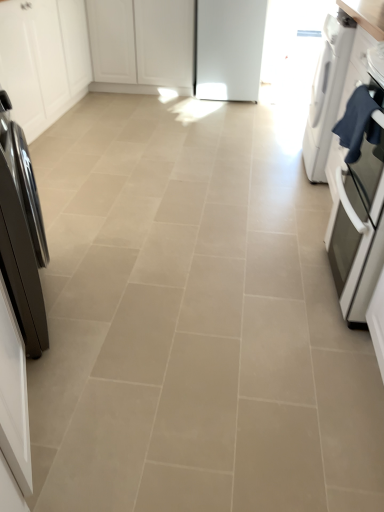
You are a GUI agent. You are given a task and a screenshot of the screen. Output one action in this format:
    pyautogui.click(x=<x>, y=<y>)
    Task: Click on the white matte cabinet at center, the first cabinetry when ordered from right to left
    The height and width of the screenshot is (512, 384).
    Given the screenshot: What is the action you would take?
    pyautogui.click(x=142, y=44)

I want to click on white glossy dryer at right, positioned as the 1th home appliance in right-to-left order, so click(327, 92).

Locate an element on the screen. The height and width of the screenshot is (512, 384). dark blue fabric at right is located at coordinates pyautogui.click(x=359, y=122).

Describe the element at coordinates (359, 207) in the screenshot. I see `matte stainless steel oven at right` at that location.

This screenshot has height=512, width=384. I want to click on matte stainless steel oven at right, so click(x=359, y=207).

Find the location of a particular element. shiny black refrigerator at left, positioned as the 2th home appliance in top-to-bottom order is located at coordinates (21, 234).

Is point (30, 345) positioned before point (330, 96)?

Yes, it is.

Considering the sizes of objects shiny black refrigerator at left, which is the first home appliance in bottom-to-top order, and white glossy dryer at right, positioned as the 1th home appliance in right-to-left order, in the image provided, who is taller, shiny black refrigerator at left, which is the first home appliance in bottom-to-top order, or white glossy dryer at right, positioned as the 1th home appliance in right-to-left order,?

shiny black refrigerator at left, which is the first home appliance in bottom-to-top order, is taller.

Is shiny black refrigerator at left, which is the first home appliance in bottom-to-top order, looking in the opposite direction of white glossy dryer at right, placed as the second home appliance when sorted from front to back?

No, shiny black refrigerator at left, which is the first home appliance in bottom-to-top order,'s orientation is not away from white glossy dryer at right, placed as the second home appliance when sorted from front to back.

From a real-world perspective, is shiny black refrigerator at left, which is the first home appliance in bottom-to-top order, positioned under white glossy dryer at right, positioned as the first home appliance in top-to-bottom order, based on gravity?

No.

Which of these two, matte stainless steel oven at right or white glossy dryer at right, the 1th home appliance from the back, stands shorter?

matte stainless steel oven at right is shorter.

Measure the distance from matte stainless steel oven at right to white glossy dryer at right, which is counted as the 2th home appliance, starting from the left.

matte stainless steel oven at right and white glossy dryer at right, which is counted as the 2th home appliance, starting from the left, are 24.16 inches apart.

Does matte stainless steel oven at right have a smaller size compared to white glossy dryer at right, which is counted as the 2th home appliance, starting from the left?

Correct, matte stainless steel oven at right occupies less space than white glossy dryer at right, which is counted as the 2th home appliance, starting from the left.

How many degrees apart are the facing directions of matte stainless steel oven at right and white glossy dryer at right, placed as the second home appliance when sorted from front to back?

0.000753 degrees separate the facing orientations of matte stainless steel oven at right and white glossy dryer at right, placed as the second home appliance when sorted from front to back.

From a real-world perspective, is white glossy dryer at right, positioned as the first home appliance in top-to-bottom order, physically located above or below shiny black refrigerator at left, the 1th home appliance from the front?

In terms of real-world spatial position, white glossy dryer at right, positioned as the first home appliance in top-to-bottom order, is below shiny black refrigerator at left, the 1th home appliance from the front.

Is white glossy dryer at right, positioned as the first home appliance in top-to-bottom order, to the left of shiny black refrigerator at left, which is the second home appliance from back to front, from the viewer's perspective?

No.

Between white glossy dryer at right, the 1th home appliance from the back, and shiny black refrigerator at left, marked as the 2th home appliance in a right-to-left arrangement, which one is positioned behind?

white glossy dryer at right, the 1th home appliance from the back.

Can you confirm if white glossy dryer at right, positioned as the 1th home appliance in right-to-left order, is taller than shiny black refrigerator at left, which is the second home appliance from back to front?

Incorrect, the height of white glossy dryer at right, positioned as the 1th home appliance in right-to-left order, is not larger of that of shiny black refrigerator at left, which is the second home appliance from back to front.

Does point (22, 164) appear closer or farther from the camera than point (363, 153)?

Point (22, 164) is closer to the camera than point (363, 153).

From a real-world perspective, between shiny black refrigerator at left, the 1th home appliance from the front, and matte stainless steel oven at right, who is vertically lower?

From a 3D spatial view, matte stainless steel oven at right is below.

Does shiny black refrigerator at left, marked as the 2th home appliance in a right-to-left arrangement, lie in front of matte stainless steel oven at right?

Yes, it is in front of matte stainless steel oven at right.

From the picture: Which of these two, shiny black refrigerator at left, which is the first home appliance in bottom-to-top order, or matte stainless steel oven at right, is bigger?

With larger size is matte stainless steel oven at right.

Which is correct: dark blue fabric at right is inside white matte cabinet at upper left, the 2th cabinetry from the right, or outside of it?

dark blue fabric at right exists outside the volume of white matte cabinet at upper left, the 2th cabinetry from the right.

Does point (351, 138) come farther from viewer compared to point (24, 44)?

No.

Is dark blue fabric at right far from white matte cabinet at upper left, the 2th cabinetry from the right?

That's right, there is a large distance between dark blue fabric at right and white matte cabinet at upper left, the 2th cabinetry from the right.

From a real-world perspective, relative to white matte cabinet at upper left, acting as the first cabinetry starting from the left, is white glossy dryer at right, the 1th home appliance from the back, vertically above or below?

In terms of real-world spatial position, white glossy dryer at right, the 1th home appliance from the back, is below white matte cabinet at upper left, acting as the first cabinetry starting from the left.

Which object is closer to the camera, white glossy dryer at right, positioned as the first home appliance in top-to-bottom order, or white matte cabinet at upper left, the 2th cabinetry from the right?

white glossy dryer at right, positioned as the first home appliance in top-to-bottom order, is closer to the camera.

Is white glossy dryer at right, positioned as the first home appliance in top-to-bottom order, facing away from white matte cabinet at upper left, the 2th cabinetry from the right?

white glossy dryer at right, positioned as the first home appliance in top-to-bottom order, does not have its back to white matte cabinet at upper left, the 2th cabinetry from the right.

How different are the orientations of white matte cabinet at upper left, acting as the first cabinetry starting from the left, and white matte cabinet at center, the second cabinetry viewed from the left, in degrees?

There is a 89.7-degree angle between the facing directions of white matte cabinet at upper left, acting as the first cabinetry starting from the left, and white matte cabinet at center, the second cabinetry viewed from the left.

Between point (80, 77) and point (91, 35), which one is positioned behind?

The point (91, 35) is farther from the camera.

Is the surface of white matte cabinet at upper left, acting as the first cabinetry starting from the left, in direct contact with white matte cabinet at center, the first cabinetry when ordered from right to left?

No, white matte cabinet at upper left, acting as the first cabinetry starting from the left, is not next to white matte cabinet at center, the first cabinetry when ordered from right to left.

From the image's perspective, relative to white matte cabinet at center, the second cabinetry viewed from the left, is white matte cabinet at upper left, the 2th cabinetry from the right, above or below?

white matte cabinet at upper left, the 2th cabinetry from the right, is situated lower than white matte cabinet at center, the second cabinetry viewed from the left, in the image.

The image size is (384, 512). What are the coordinates of `home appliance in front of the white glossy dryer at right, positioned as the 1th home appliance in right-to-left order` in the screenshot? It's located at (21, 234).

You are a GUI agent. You are given a task and a screenshot of the screen. Output one action in this format:
    pyautogui.click(x=<x>, y=<y>)
    Task: Click on the home appliance that is the 1st one above the matte stainless steel oven at right (from a real-world perspective)
    
    Given the screenshot: What is the action you would take?
    [327, 92]

Looking at the image, which one is located further to dark blue fabric at right, white matte cabinet at center, the second cabinetry viewed from the left, or matte stainless steel oven at right?

white matte cabinet at center, the second cabinetry viewed from the left, is further to dark blue fabric at right.

Which object lies nearer to the anchor point white matte cabinet at center, the first cabinetry when ordered from right to left, white matte cabinet at upper left, the 2th cabinetry from the right, or matte stainless steel oven at right?

The object closer to white matte cabinet at center, the first cabinetry when ordered from right to left, is white matte cabinet at upper left, the 2th cabinetry from the right.

Estimate the real-world distances between objects in this image. Which object is further from white matte cabinet at upper left, acting as the first cabinetry starting from the left, dark blue fabric at right or white glossy dryer at right, which is counted as the 2th home appliance, starting from the left?

dark blue fabric at right is positioned further to the anchor white matte cabinet at upper left, acting as the first cabinetry starting from the left.

Estimate the real-world distances between objects in this image. Which object is closer to shiny black refrigerator at left, the 1th home appliance from the front, white matte cabinet at upper left, the 2th cabinetry from the right, or matte stainless steel oven at right?

matte stainless steel oven at right.

Looking at the image, which one is located closer to white matte cabinet at center, the first cabinetry when ordered from right to left, shiny black refrigerator at left, the 1th home appliance from the left, or matte stainless steel oven at right?

Based on the image, matte stainless steel oven at right appears to be nearer to white matte cabinet at center, the first cabinetry when ordered from right to left.

Based on their spatial positions, is matte stainless steel oven at right or white matte cabinet at center, the second cabinetry viewed from the left, closer to dark blue fabric at right?

The object closer to dark blue fabric at right is matte stainless steel oven at right.

Looking at this image, from the image, which object appears to be farther from matte stainless steel oven at right, white glossy dryer at right, arranged as the second home appliance when ordered from the bottom, or white matte cabinet at center, the first cabinetry when ordered from right to left?

white matte cabinet at center, the first cabinetry when ordered from right to left, lies further to matte stainless steel oven at right than the other object.

Looking at the image, which one is located further to matte stainless steel oven at right, dark blue fabric at right or white matte cabinet at center, the second cabinetry viewed from the left?

white matte cabinet at center, the second cabinetry viewed from the left, lies further to matte stainless steel oven at right than the other object.

Where is `laundry located between shiny black refrigerator at left, which is the second home appliance from back to front, and white glossy dryer at right, positioned as the 1th home appliance in right-to-left order, in the left-right direction`? The image size is (384, 512). laundry located between shiny black refrigerator at left, which is the second home appliance from back to front, and white glossy dryer at right, positioned as the 1th home appliance in right-to-left order, in the left-right direction is located at coordinates (359, 122).

This screenshot has height=512, width=384. I want to click on home appliance between white matte cabinet at upper left, acting as the first cabinetry starting from the left, and dark blue fabric at right from left to right, so tap(21, 234).

At what (x,y) coordinates should I click in order to perform the action: click on cabinetry located between white matte cabinet at upper left, the 2th cabinetry from the right, and white glossy dryer at right, arranged as the second home appliance when ordered from the bottom, in the left-right direction. Please return your answer as a coordinate pair (x, y). This screenshot has height=512, width=384. Looking at the image, I should click on (142, 44).

The height and width of the screenshot is (512, 384). Identify the location of home appliance positioned between matte stainless steel oven at right and white matte cabinet at center, the first cabinetry when ordered from right to left, from near to far. (327, 92).